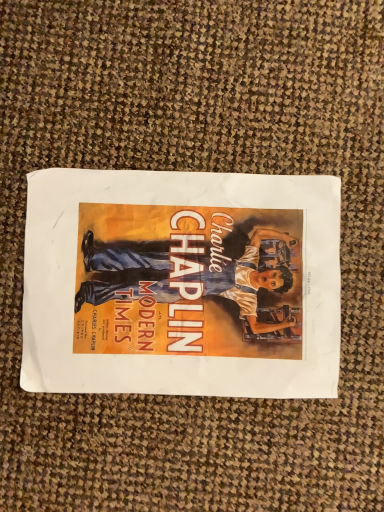
Where is `free point above matte paper poster at center (from a real-world perspective)`? The height and width of the screenshot is (512, 384). free point above matte paper poster at center (from a real-world perspective) is located at coordinates (177, 288).